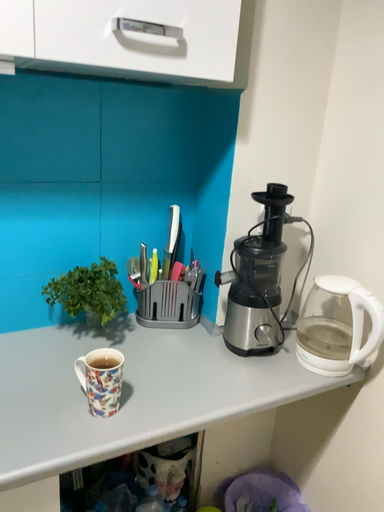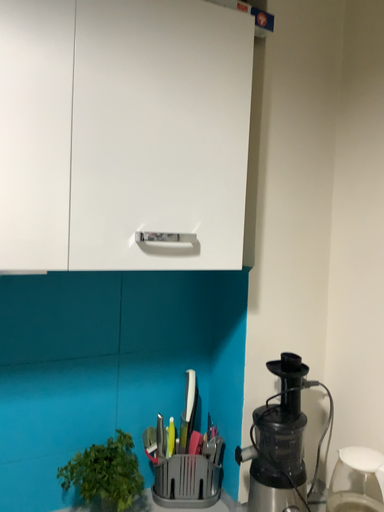
Question: Which way did the camera rotate in the video?

Choices:
 (A) rotated upward
 (B) rotated downward

Answer: (A)